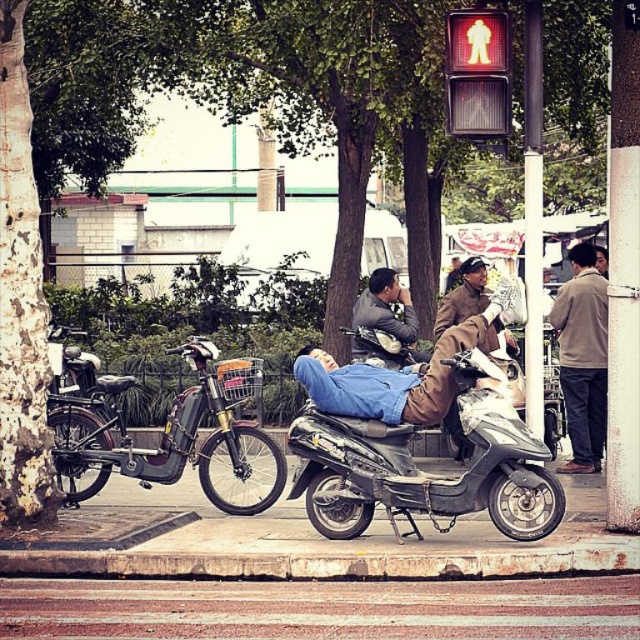
Does concrete at lower center have a greater width compared to brown cotton jacket at right?

Correct, the width of concrete at lower center exceeds that of brown cotton jacket at right.

Measure the distance between point (490, 563) and camera.

The distance of point (490, 563) from camera is 26.69 feet.

You are a GUI agent. You are given a task and a screenshot of the screen. Output one action in this format:
    pyautogui.click(x=<x>, y=<y>)
    Task: Click on the concrete at lower center
    The image size is (640, 640).
    Given the screenshot: What is the action you would take?
    (x=321, y=563)

Can you confirm if paved asphalt road at lower center is positioned to the right of red glass pedestrian signal at upper right?

No, paved asphalt road at lower center is not to the right of red glass pedestrian signal at upper right.

Does paved asphalt road at lower center lie in front of red glass pedestrian signal at upper right?

Yes, it is.

Who is more forward, (256, 588) or (486, 77)?

Point (256, 588)

Locate an element on the screen. paved asphalt road at lower center is located at coordinates (321, 609).

Can you confirm if metallic silver scooter at left is taller than matte gray jacket at center?

Yes.

Is metallic silver scooter at left thinner than matte gray jacket at center?

No, metallic silver scooter at left is not thinner than matte gray jacket at center.

Does point (244, 515) come closer to viewer compared to point (388, 320)?

Yes, point (244, 515) is in front of point (388, 320).

Locate an element on the screen. Image resolution: width=640 pixels, height=640 pixels. metallic silver scooter at left is located at coordinates (163, 429).